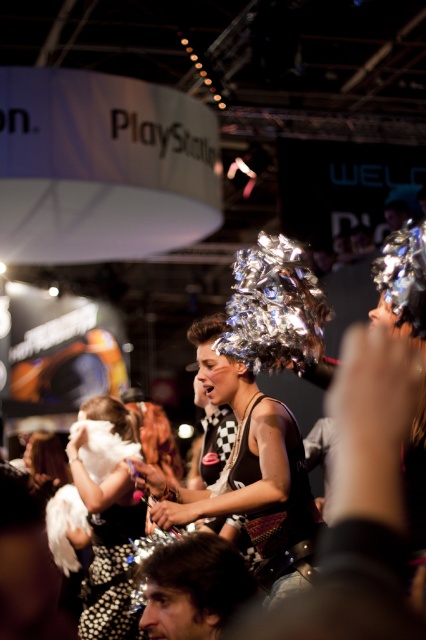
Question: Which of these objects is positioned closest to the shiny metallic pom-pom at center?

Choices:
 (A) dark brown hair at lower left
 (B) white fluffy wings at center

Answer: (A)

Question: Among these points, which one is nearest to the camera?

Choices:
 (A) (273, 573)
 (B) (98, 618)
 (C) (244, 600)

Answer: (C)

Question: Considering the relative positions of white fluffy wings at center and dark brown hair at lower left in the image provided, where is white fluffy wings at center located with respect to dark brown hair at lower left?

Choices:
 (A) below
 (B) above

Answer: (A)

Question: Is shiny metallic pom-pom at center positioned at the back of dark brown hair at lower left?

Choices:
 (A) yes
 (B) no

Answer: (A)

Question: Which is nearer to the dark brown hair at lower left?

Choices:
 (A) shiny metallic pom-pom at center
 (B) white fluffy wings at center

Answer: (A)

Question: Can you confirm if white fluffy wings at center is positioned to the right of dark brown hair at lower left?

Choices:
 (A) yes
 (B) no

Answer: (B)